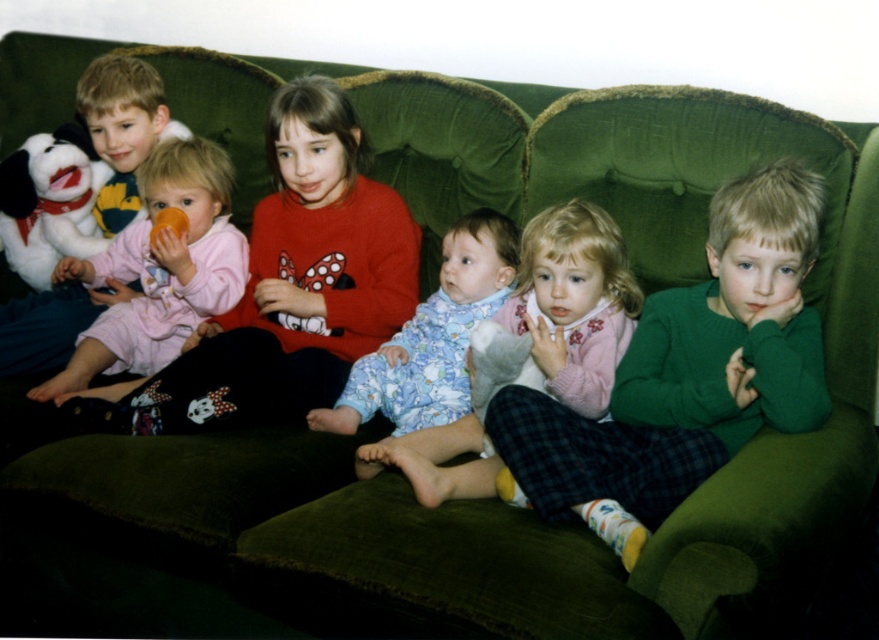
You are a photographer trying to capture a candid shot of the children on the couch. You need to ensure there is enough space between the green cotton shirt at center and the fluffy blue pajamas at center to avoid blurring both in the photo. According to the scene description, what is the minimum distance you should maintain between the camera and the couch to achieve this?

The minimum distance should be at least 15.77 inches to ensure both the green cotton shirt at center and the fluffy blue pajamas at center are in focus without blurring.